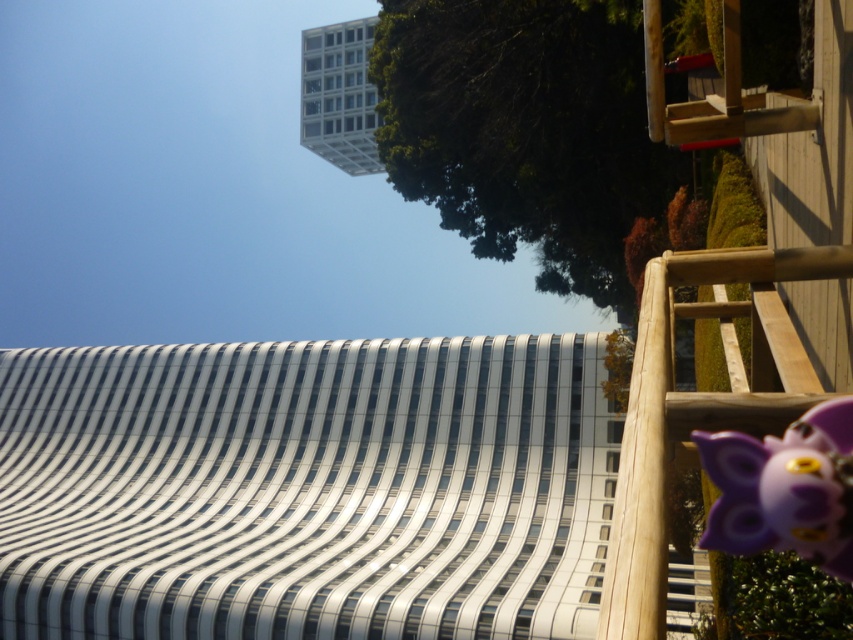
You are a city planner assessing the view from the balcony. You need to determine if the green leafy tree at upper center and the purple matte toy at lower right are within a 100 feet distance from each other to ensure proper landscaping regulations. Are they within the required distance?

The green leafy tree at upper center and the purple matte toy at lower right are 76.50 feet apart from each other, which is within the 100 feet requirement. They comply with the landscaping regulations.

You are an architect designing a new balcony for this skyscraper. You need to place both the green leafy tree at upper center and the purple matte toy at lower right on the balcony. Which object should you place closer to the edge to ensure visibility from the street below?

The green leafy tree at upper center should be placed closer to the edge because it is bigger than the purple matte toy at lower right, making it more visible from below.